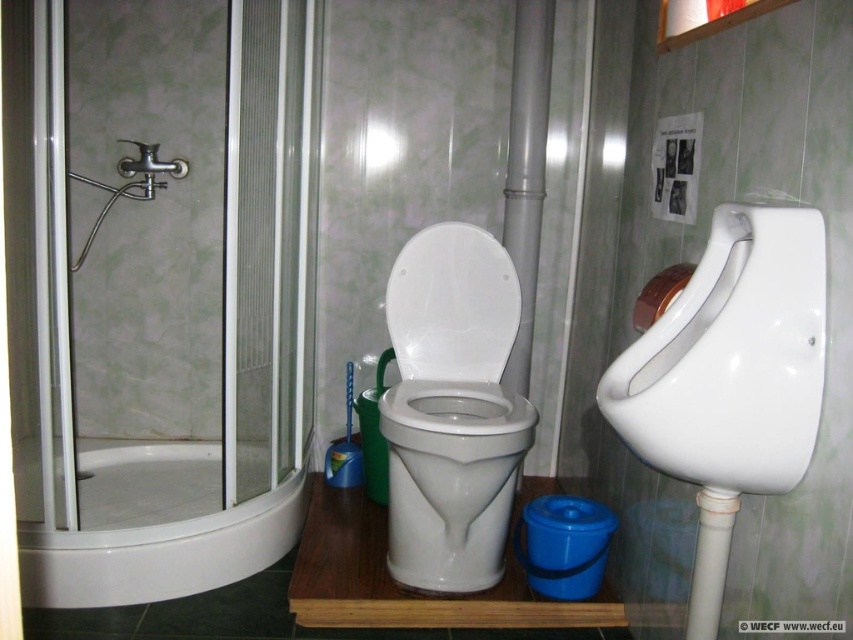
You are a maintenance worker checking the bathroom facilities. You need to determine which object is taller between the white glossy bathtub at lower left and the brushed metal faucet at upper left. Which one is taller?

The white glossy bathtub at lower left is taller than the brushed metal faucet at upper left according to the description.

You are a plumber inspecting the bathroom. The white glossy toilet bowl at center and the brushed metal faucet at upper left are both potential sources of a leak. Which one should you check first if the leak is coming from the wider object?

You should check the white glossy toilet bowl at center first because it might be wider than the brushed metal faucet at upper left, making it more likely to be the source of the leak.

You are a plumber inspecting the bathroom and need to replace the white glossy bathtub at lower left and the brushed metal faucet at upper left. Which one requires a larger replacement part?

The white glossy bathtub at lower left requires a larger replacement part since it is bigger than the brushed metal faucet at upper left.